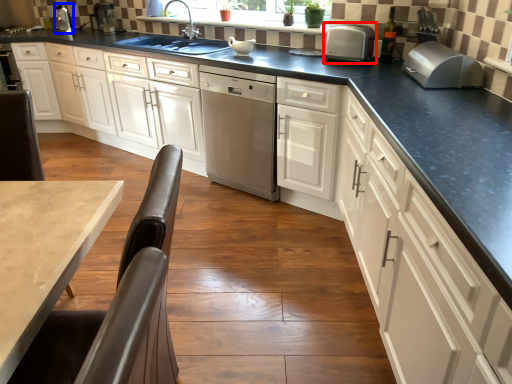
Question: Among these objects, which one is nearest to the camera, kitchen appliance (highlighted by a red box) or appliance (highlighted by a blue box)?

Choices:
 (A) kitchen appliance
 (B) appliance

Answer: (A)